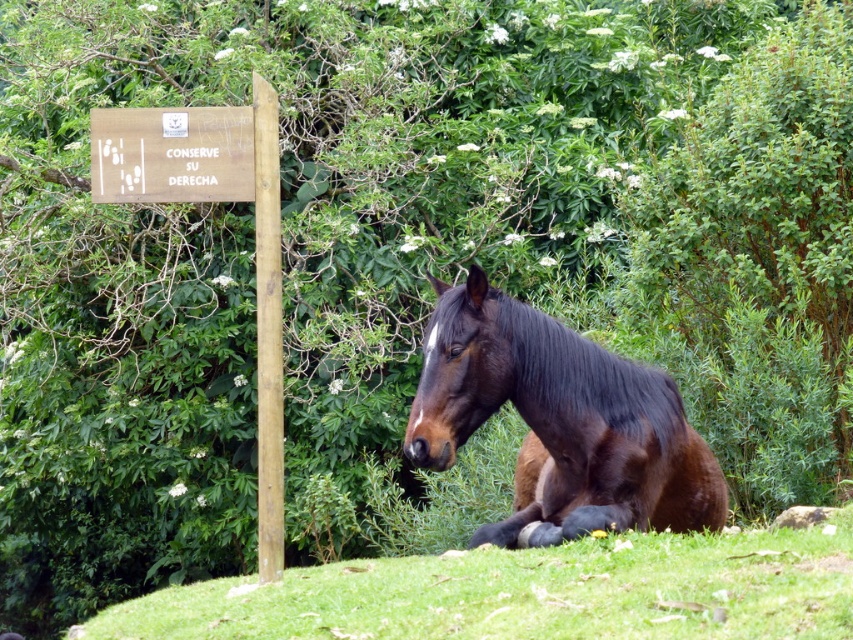
You are a hiker walking along a trail and see the shiny brown horse at center and the wooden sign at upper left. Which object is nearer to you?

The shiny brown horse at center is closer to the viewer than the wooden sign at upper left.